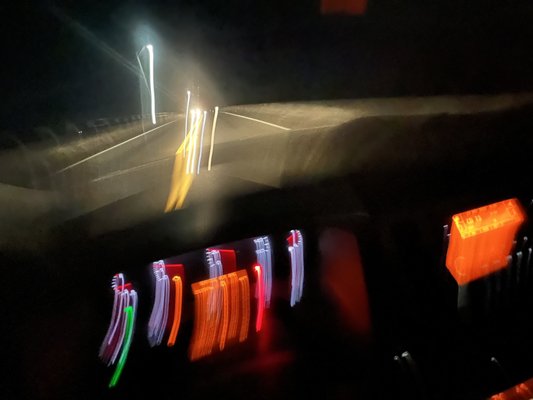
What are the coordinates of `hood` in the screenshot? It's located at (242, 147).